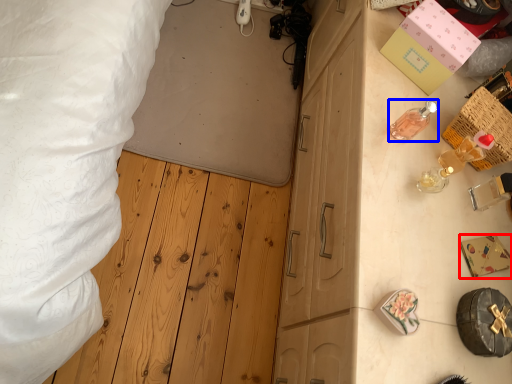
Question: Which object appears farthest to the camera in this image, box (highlighted by a red box) or toiletry (highlighted by a blue box)?

Choices:
 (A) box
 (B) toiletry

Answer: (A)